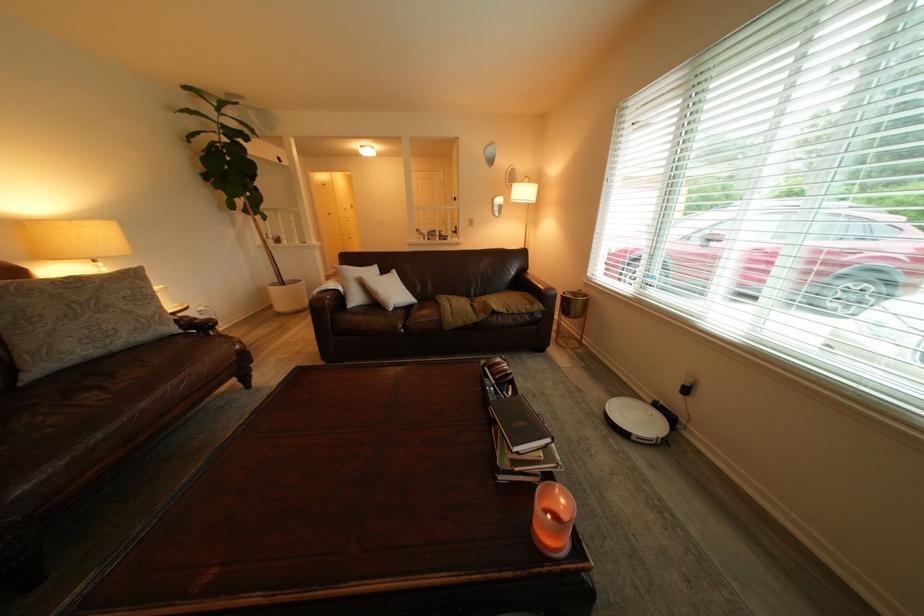
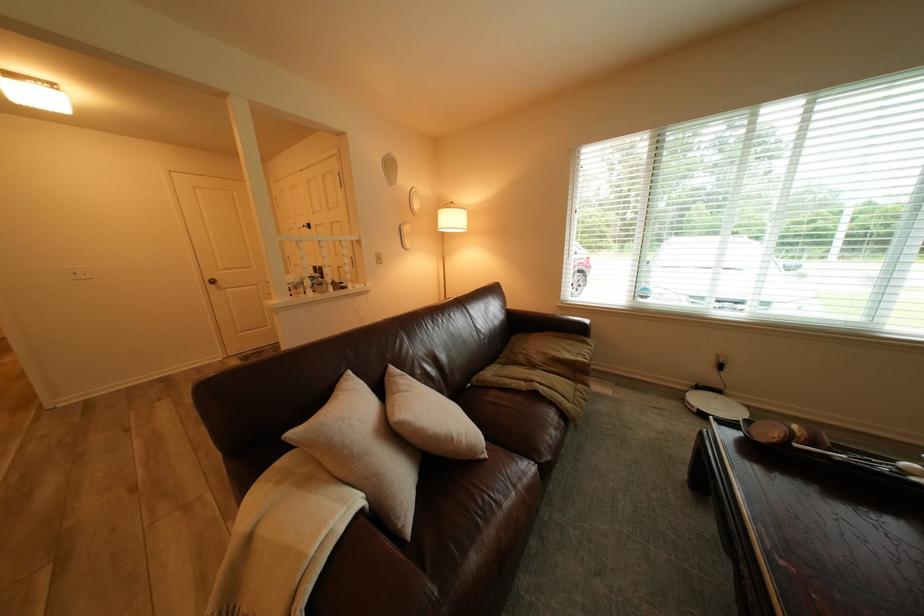
Locate, in the second image, the point that corresponds to [393,294] in the first image.

(468, 438)